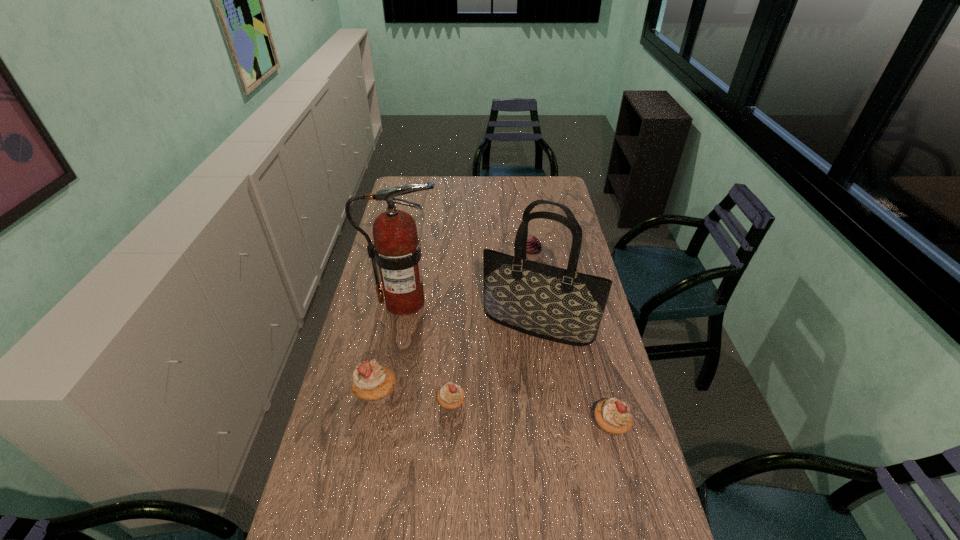
Locate an element on the screen. the third tallest object is located at coordinates (372, 382).

Image resolution: width=960 pixels, height=540 pixels. What are the coordinates of `the tallest cupcake` in the screenshot? It's located at (372, 382).

In order to click on the second cupcake from left to right in this screenshot , I will do `click(450, 396)`.

Image resolution: width=960 pixels, height=540 pixels. What are the coordinates of `the rightmost cupcake` in the screenshot? It's located at (613, 416).

Where is `the farthest cupcake`? Image resolution: width=960 pixels, height=540 pixels. the farthest cupcake is located at coordinates (534, 247).

Locate an element on the screen. the third cupcake from left to right is located at coordinates (534, 247).

You are a GUI agent. You are given a task and a screenshot of the screen. Output one action in this format:
    pyautogui.click(x=<x>, y=<y>)
    Task: Click on the tote bag
    The image size is (960, 540).
    Given the screenshot: What is the action you would take?
    pyautogui.click(x=561, y=305)

In order to click on fire extinguisher in this screenshot , I will do `click(397, 250)`.

The width and height of the screenshot is (960, 540). What are the coordinates of `vacant space located 0.220m on the front of the leftmost cupcake` in the screenshot? It's located at (358, 485).

Locate an element on the screen. The width and height of the screenshot is (960, 540). free space located 0.290m on the front of the second cupcake from left to right is located at coordinates (444, 520).